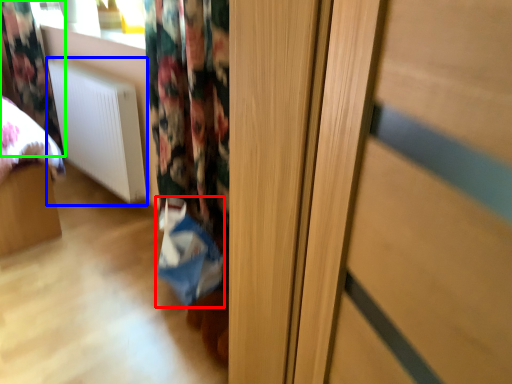
Question: Which object is positioned closest to shopping bag (highlighted by a red box)? Select from radiator (highlighted by a blue box) and curtain (highlighted by a green box).

Choices:
 (A) radiator
 (B) curtain

Answer: (A)